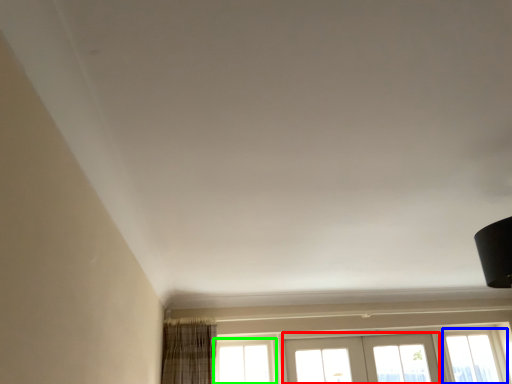
Question: Estimate the real-world distances between objects in this image. Which object is farther from screen door (highlighted by a red box), window (highlighted by a blue box) or window (highlighted by a green box)?

Choices:
 (A) window
 (B) window

Answer: (B)